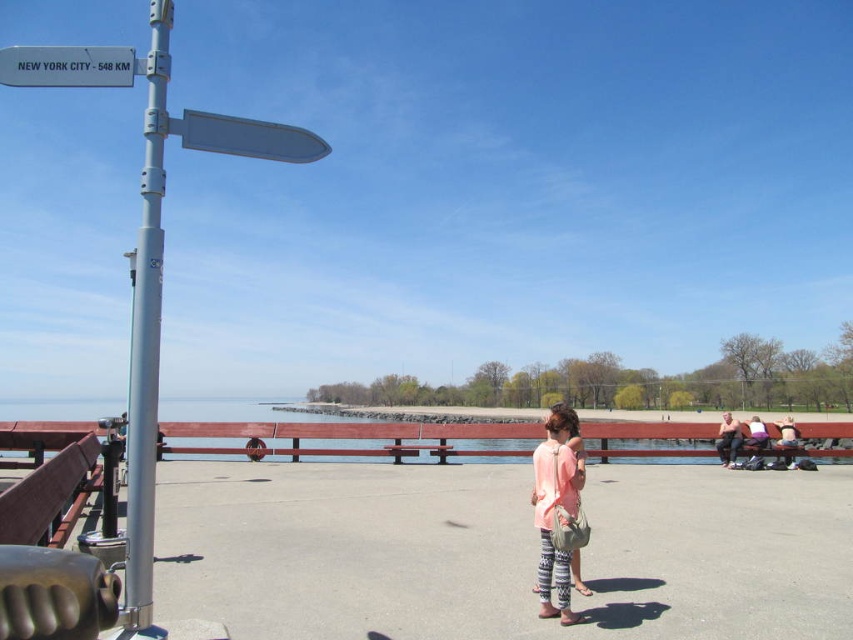
Question: Does white plastic sign at upper left appear under tan leather jacket at right?

Choices:
 (A) no
 (B) yes

Answer: (A)

Question: Among these objects, which one is nearest to the camera?

Choices:
 (A) light purple fabric at lower right
 (B) tan leather jacket at right
 (C) light pink fabric dress at center

Answer: (C)

Question: Is light pink fabric dress at center wider than white plastic sign at upper left?

Choices:
 (A) no
 (B) yes

Answer: (A)

Question: Which object is farther from the camera taking this photo?

Choices:
 (A) light purple fabric at lower right
 (B) pink fabric person at right
 (C) metallic gray sign at upper center
 (D) white plastic sign at upper left

Answer: (B)

Question: Which object is closer to the camera taking this photo?

Choices:
 (A) light pink fabric dress at center
 (B) metallic gray sign at upper center
 (C) silver metallic pole at left

Answer: (C)

Question: Does light pink fabric dress at center appear on the right side of metallic gray sign at upper center?

Choices:
 (A) yes
 (B) no

Answer: (A)